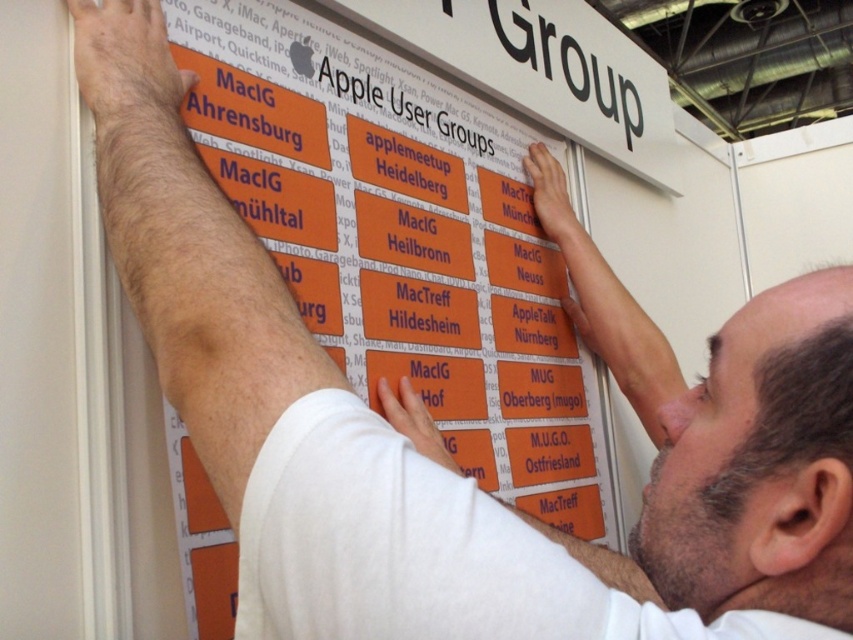
Can you confirm if orange matte sign at upper center is positioned below orange matte sign at center?

Yes.

Who is more distant from viewer, (422, 291) or (405, 104)?

Positioned behind is point (405, 104).

Locate an element on the screen. This screenshot has width=853, height=640. orange matte sign at upper center is located at coordinates [405, 241].